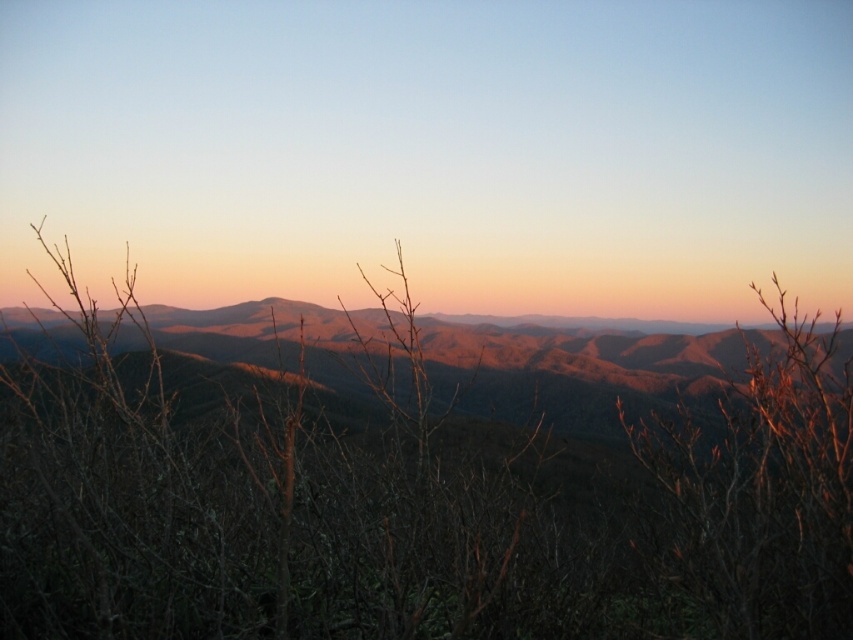
Does brown dry branches at center appear on the left side of brown matte mountain range at center?

In fact, brown dry branches at center is to the right of brown matte mountain range at center.

Image resolution: width=853 pixels, height=640 pixels. In order to click on brown dry branches at center in this screenshot , I will do `click(413, 515)`.